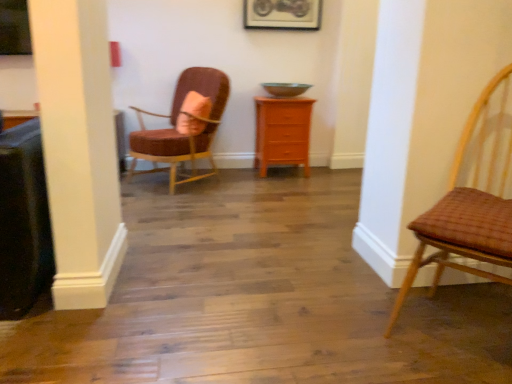
Identify the location of vacant area that is in front of velvet pink chair at upper left, which is the second chair from right to left. (181, 204).